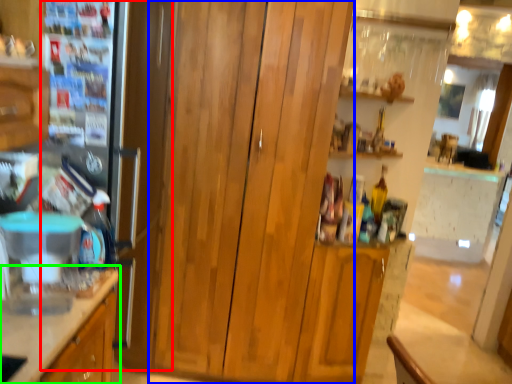
Question: Which object is positioned farthest from fridge (highlighted by a red box)? Select from dresser (highlighted by a blue box) and cabinetry (highlighted by a green box).

Choices:
 (A) dresser
 (B) cabinetry

Answer: (B)